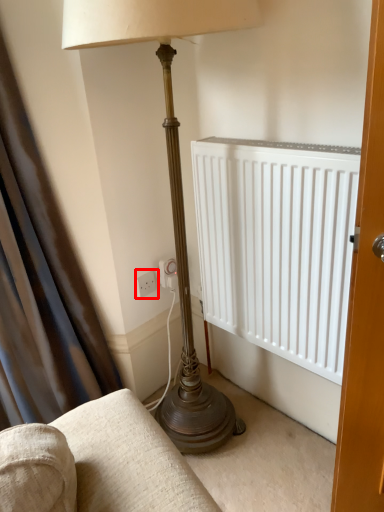
Question: Considering the relative positions of electric outlet (annotated by the red box) and curtain in the image provided, where is electric outlet (annotated by the red box) located with respect to the staircase?

Choices:
 (A) right
 (B) left

Answer: (A)